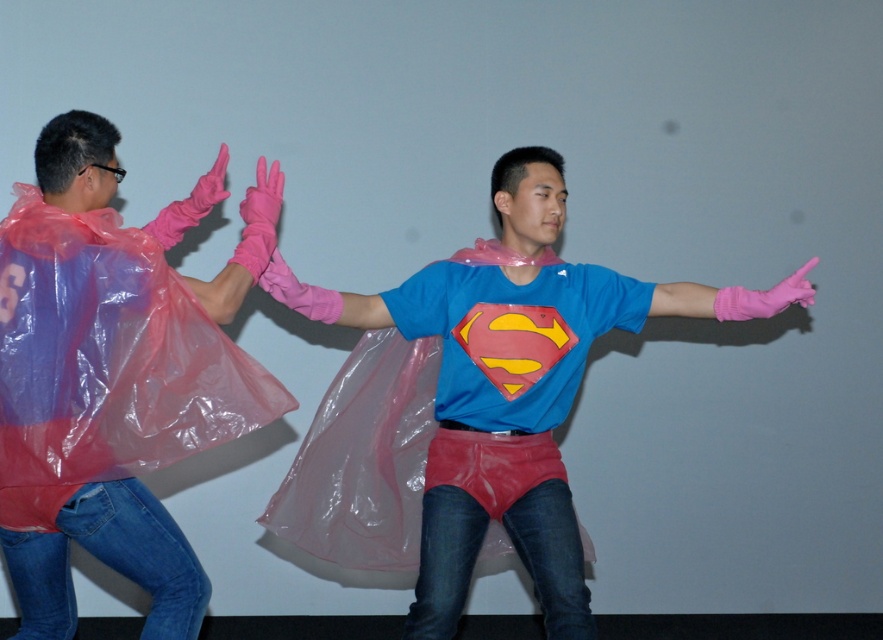
Does point (54, 636) come farther from viewer compared to point (390, 502)?

That is False.

Between transparent plastic cape at left and blue fabric superman shirt at center, which one is positioned lower?

blue fabric superman shirt at center is below.

The height and width of the screenshot is (640, 883). Identify the location of transparent plastic cape at left. (114, 376).

In order to click on transparent plastic cape at left in this screenshot , I will do `click(114, 376)`.

Is transparent plastic cape at left thinner than matte plastic superman costume at center?

Yes, transparent plastic cape at left is thinner than matte plastic superman costume at center.

Who is lower down, transparent plastic cape at left or matte plastic superman costume at center?

matte plastic superman costume at center is below.

Find the location of a particular element. This screenshot has width=883, height=640. transparent plastic cape at left is located at coordinates (114, 376).

Which is more to the left, matte plastic superman costume at center or blue fabric superman shirt at center?

blue fabric superman shirt at center is more to the left.

Is matte plastic superman costume at center smaller than blue fabric superman shirt at center?

Incorrect, matte plastic superman costume at center is not smaller in size than blue fabric superman shirt at center.

What do you see at coordinates (509, 387) in the screenshot? I see `matte plastic superman costume at center` at bounding box center [509, 387].

This screenshot has height=640, width=883. Find the location of `matte plastic superman costume at center`. matte plastic superman costume at center is located at coordinates point(509,387).